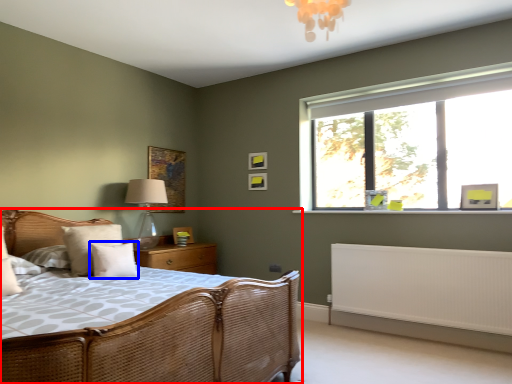
Question: Which object appears farthest to the camera in this image, bed (highlighted by a red box) or pillow (highlighted by a blue box)?

Choices:
 (A) bed
 (B) pillow

Answer: (B)